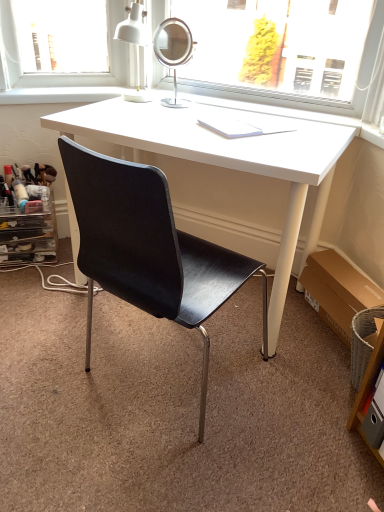
Find the location of a particular element. Image resolution: width=384 pixels, height=512 pixels. free location to the left of brown cardboard box at lower right is located at coordinates (284, 332).